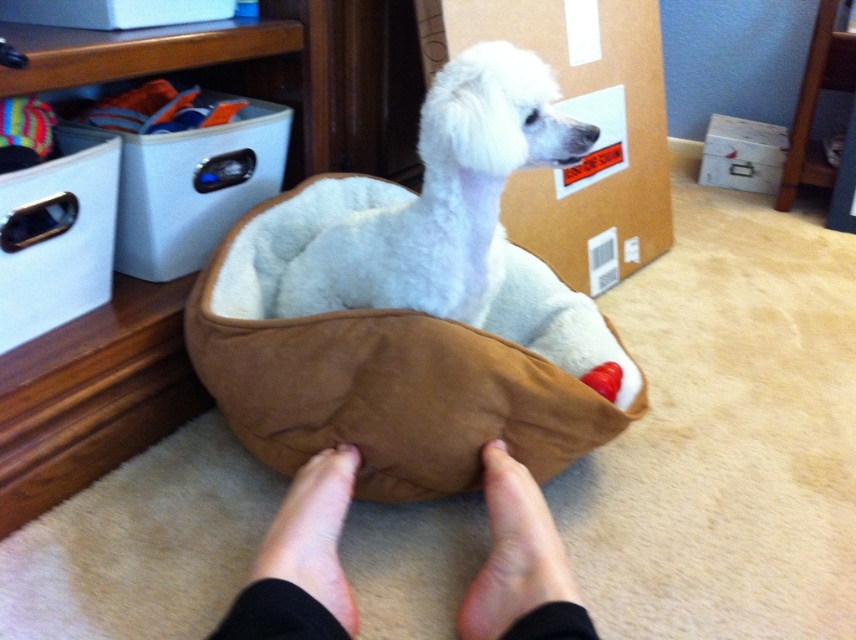
Question: Which object is the farthest from the white plush dog at center?

Choices:
 (A) skinny barefoot at lower center
 (B) white cardboard box at upper left
 (C) brown suede foot at center
 (D) cardboard at upper center

Answer: (D)

Question: Is skinny bare feet at lower center below brown cardboard box at upper center?

Choices:
 (A) no
 (B) yes

Answer: (B)

Question: Does cardboard at upper center appear on the right side of brown suede foot at center?

Choices:
 (A) yes
 (B) no

Answer: (A)

Question: Which point is closer to the camera?

Choices:
 (A) skinny barefoot at lower center
 (B) white cardboard box at upper left
 (C) skinny bare feet at lower center
 (D) white cardboard box at upper right

Answer: (C)

Question: Which object is closer to the camera taking this photo?

Choices:
 (A) white cardboard box at upper right
 (B) white cardboard box at upper left
 (C) white plush dog at center

Answer: (C)

Question: Is brown suede cat bed at center smaller than white cardboard box at upper right?

Choices:
 (A) yes
 (B) no

Answer: (B)